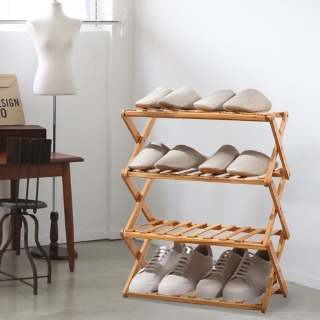
Locate an element on the screen. The image size is (320, 320). wood shelves is located at coordinates (205, 115), (204, 179), (200, 240), (194, 301).